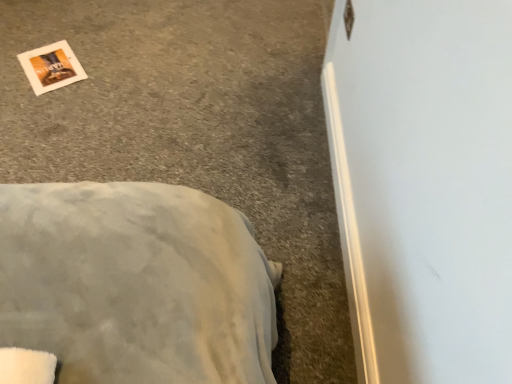
Question: Is gray carpet at lower left touching white paper at upper left?

Choices:
 (A) yes
 (B) no

Answer: (B)

Question: Considering the relative sizes of gray carpet at lower left and white paper at upper left in the image provided, is gray carpet at lower left smaller than white paper at upper left?

Choices:
 (A) no
 (B) yes

Answer: (A)

Question: Would you consider gray carpet at lower left to be distant from white paper at upper left?

Choices:
 (A) no
 (B) yes

Answer: (A)

Question: From a real-world perspective, is gray carpet at lower left on white paper at upper left?

Choices:
 (A) no
 (B) yes

Answer: (A)

Question: From the image's perspective, is gray carpet at lower left above white paper at upper left?

Choices:
 (A) no
 (B) yes

Answer: (A)

Question: Is gray carpet at lower left taller than white paper at upper left?

Choices:
 (A) no
 (B) yes

Answer: (B)

Question: Does white paper at upper left have a greater height compared to gray carpet at lower left?

Choices:
 (A) yes
 (B) no

Answer: (B)

Question: Is white paper at upper left not near gray carpet at lower left?

Choices:
 (A) no
 (B) yes

Answer: (A)

Question: Considering the relative sizes of white paper at upper left and gray carpet at lower left in the image provided, is white paper at upper left wider than gray carpet at lower left?

Choices:
 (A) yes
 (B) no

Answer: (B)

Question: Are white paper at upper left and gray carpet at lower left making contact?

Choices:
 (A) yes
 (B) no

Answer: (B)

Question: From the image's perspective, is white paper at upper left located beneath gray carpet at lower left?

Choices:
 (A) no
 (B) yes

Answer: (A)

Question: Can you confirm if white paper at upper left is positioned to the right of gray carpet at lower left?

Choices:
 (A) no
 (B) yes

Answer: (A)

Question: Is gray carpet at lower left taller or shorter than white paper at upper left?

Choices:
 (A) short
 (B) tall

Answer: (B)